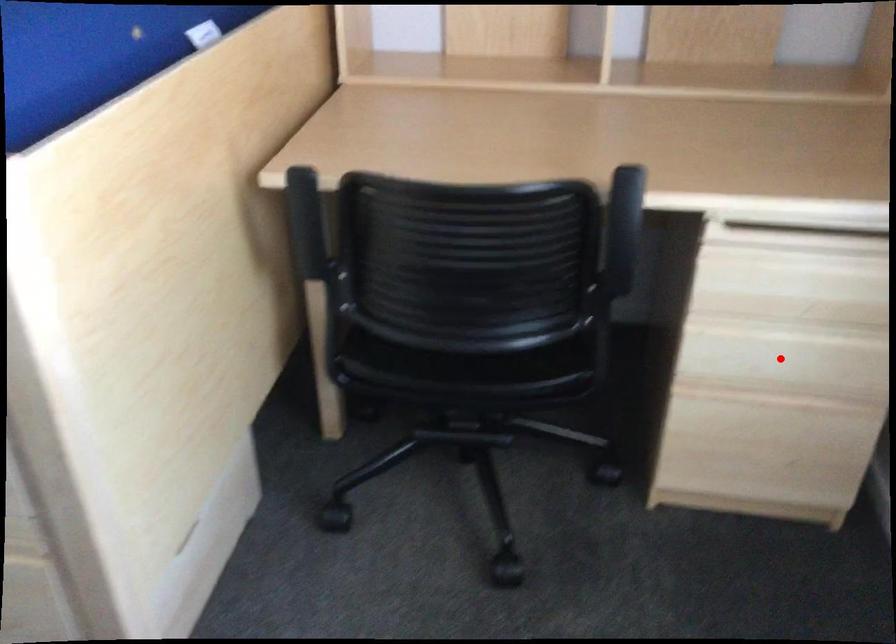
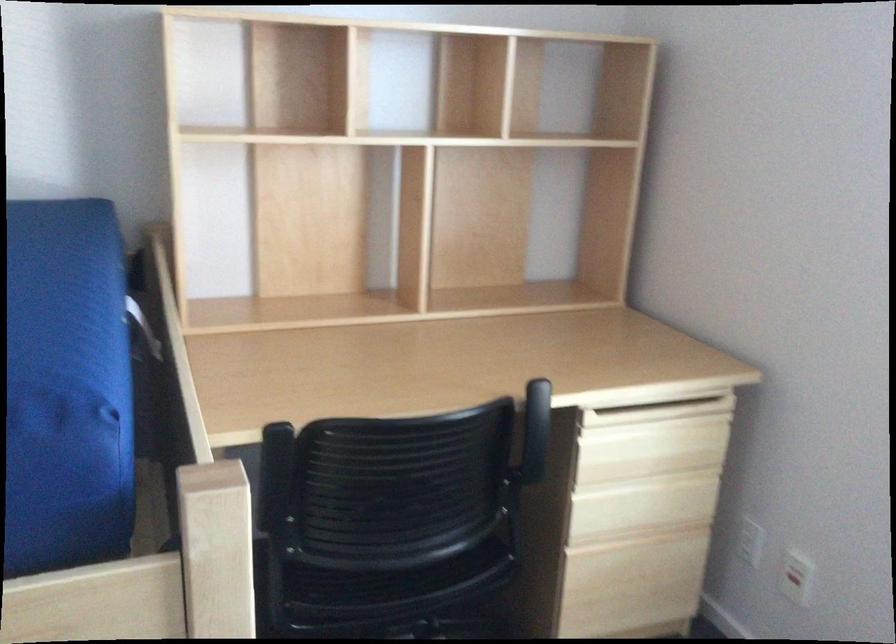
In the second image, find the point that corresponds to the highlighted location in the first image.

(642, 506)